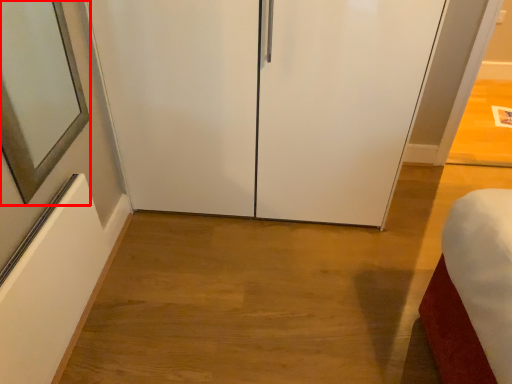
Question: From the image's perspective, where is mirror (annotated by the red box) located in relation to glass door in the image?

Choices:
 (A) above
 (B) below

Answer: (B)